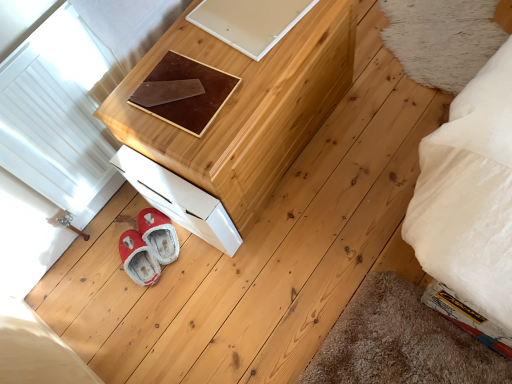
Question: Is brown leather pad at center inside white glossy drawer at lower left?

Choices:
 (A) no
 (B) yes

Answer: (A)

Question: Is white glossy drawer at lower left in contact with brown leather pad at center?

Choices:
 (A) no
 (B) yes

Answer: (A)

Question: From the image's perspective, is white glossy drawer at lower left on brown leather pad at center?

Choices:
 (A) no
 (B) yes

Answer: (A)

Question: Considering the relative positions of white glossy drawer at lower left and brown leather pad at center in the image provided, is white glossy drawer at lower left to the right of brown leather pad at center from the viewer's perspective?

Choices:
 (A) no
 (B) yes

Answer: (A)

Question: Considering the relative sizes of white glossy drawer at lower left and brown leather pad at center in the image provided, is white glossy drawer at lower left shorter than brown leather pad at center?

Choices:
 (A) yes
 (B) no

Answer: (B)

Question: Considering the positions of point pyautogui.click(x=119, y=129) and point pyautogui.click(x=212, y=200), is point pyautogui.click(x=119, y=129) closer or farther from the camera than point pyautogui.click(x=212, y=200)?

Choices:
 (A) farther
 (B) closer

Answer: (B)

Question: Is natural wood chest of drawers at upper center taller or shorter than white glossy drawer at lower left?

Choices:
 (A) tall
 (B) short

Answer: (A)

Question: From a real-world perspective, is natural wood chest of drawers at upper center physically located above or below white glossy drawer at lower left?

Choices:
 (A) above
 (B) below

Answer: (A)

Question: Considering the positions of natural wood chest of drawers at upper center and white glossy drawer at lower left in the image, is natural wood chest of drawers at upper center wider or thinner than white glossy drawer at lower left?

Choices:
 (A) wide
 (B) thin

Answer: (A)

Question: Is white glossy drawer at lower left spatially inside brown leather pad at center, or outside of it?

Choices:
 (A) outside
 (B) inside

Answer: (A)

Question: From the image's perspective, is white glossy drawer at lower left above or below brown leather pad at center?

Choices:
 (A) above
 (B) below

Answer: (B)

Question: From a real-world perspective, relative to brown leather pad at center, is white glossy drawer at lower left vertically above or below?

Choices:
 (A) above
 (B) below

Answer: (B)

Question: Based on their positions, is white glossy drawer at lower left located to the left or right of brown leather pad at center?

Choices:
 (A) right
 (B) left

Answer: (B)

Question: In terms of size, does brown leather pad at center appear bigger or smaller than fuzzy red slippers at lower left?

Choices:
 (A) small
 (B) big

Answer: (A)

Question: From the image's perspective, relative to fuzzy red slippers at lower left, is brown leather pad at center above or below?

Choices:
 (A) above
 (B) below

Answer: (A)